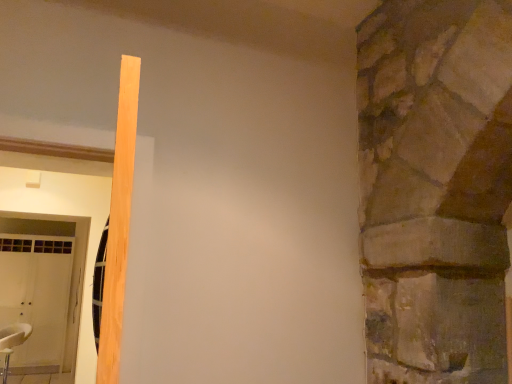
The height and width of the screenshot is (384, 512). What do you see at coordinates (119, 224) in the screenshot?
I see `light wood beam at left` at bounding box center [119, 224].

Measure the distance between point (x=125, y=87) and camera.

They are 30.79 inches apart.

Identify the location of light wood beam at left. This screenshot has height=384, width=512. (119, 224).

The height and width of the screenshot is (384, 512). I want to click on white leather chair at lower left, so click(x=12, y=342).

What do you see at coordinates (12, 342) in the screenshot? The height and width of the screenshot is (384, 512). I see `white leather chair at lower left` at bounding box center [12, 342].

The height and width of the screenshot is (384, 512). I want to click on light wood beam at left, so click(119, 224).

Which object is positioned more to the right, white leather chair at lower left or light wood beam at left?

Positioned to the right is light wood beam at left.

Based on the photo, in the image, is white leather chair at lower left positioned in front of or behind light wood beam at left?

In the image, white leather chair at lower left appears behind light wood beam at left.

Which is closer to the camera, (5, 367) or (132, 79)?

Positioned in front is point (132, 79).

From the image's perspective, relative to light wood beam at left, is white leather chair at lower left above or below?

Based on their image positions, white leather chair at lower left is located beneath light wood beam at left.

From a real-world perspective, is white leather chair at lower left physically located above or below light wood beam at left?

In terms of real-world spatial position, white leather chair at lower left is below light wood beam at left.

In terms of width, does white leather chair at lower left look wider or thinner when compared to light wood beam at left?

Clearly, white leather chair at lower left has more width compared to light wood beam at left.

Who is shorter, white leather chair at lower left or light wood beam at left?

Standing shorter between the two is light wood beam at left.

Is white leather chair at lower left smaller than light wood beam at left?

No, white leather chair at lower left is not smaller than light wood beam at left.

Is light wood beam at left completely or partially inside white leather chair at lower left?

No, light wood beam at left is not a part of white leather chair at lower left.

Does white leather chair at lower left touch light wood beam at left?

They are not placed beside each other.

Is white leather chair at lower left oriented away from light wood beam at left?

No, light wood beam at left is not at the back of white leather chair at lower left.

Identify the location of chair behind the light wood beam at left. This screenshot has width=512, height=384. [x=12, y=342].

Can you confirm if light wood beam at left is positioned to the left of white leather chair at lower left?

Incorrect, light wood beam at left is not on the left side of white leather chair at lower left.

Is the depth of light wood beam at left less than that of white leather chair at lower left?

Yes, it is in front of white leather chair at lower left.

Which is in front, point (118, 234) or point (15, 346)?

The point (118, 234) is closer.

From the image's perspective, which one is positioned higher, light wood beam at left or white leather chair at lower left?

light wood beam at left is shown above in the image.

From a real-world perspective, who is located higher, light wood beam at left or white leather chair at lower left?

light wood beam at left.

Does light wood beam at left have a lesser width compared to white leather chair at lower left?

Yes, light wood beam at left is thinner than white leather chair at lower left.

Who is taller, light wood beam at left or white leather chair at lower left?

white leather chair at lower left is taller.

Who is bigger, light wood beam at left or white leather chair at lower left?

Bigger between the two is white leather chair at lower left.

Would you say light wood beam at left is inside or outside white leather chair at lower left?

light wood beam at left is outside white leather chair at lower left.

Is light wood beam at left not close to white leather chair at lower left?

light wood beam at left is positioned a significant distance from white leather chair at lower left.

Is white leather chair at lower left at the back of light wood beam at left?

light wood beam at left does not have its back to white leather chair at lower left.

Where is `chair on the left of light wood beam at left`? chair on the left of light wood beam at left is located at coordinates (12, 342).

Locate an element on the screen. This screenshot has width=512, height=384. beam above the white leather chair at lower left (from a real-world perspective) is located at coordinates coord(119,224).

You are a GUI agent. You are given a task and a screenshot of the screen. Output one action in this format:
    pyautogui.click(x=<x>, y=<y>)
    Task: Click on the chair that is behind the light wood beam at left
    The image size is (512, 384).
    Given the screenshot: What is the action you would take?
    pos(12,342)